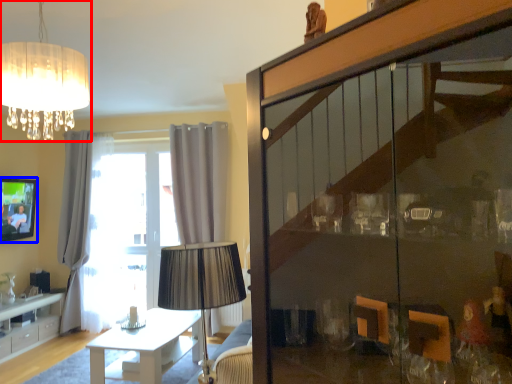
Question: Which of the following is the farthest to the observer, lamp (highlighted by a red box) or picture frame (highlighted by a blue box)?

Choices:
 (A) lamp
 (B) picture frame

Answer: (B)